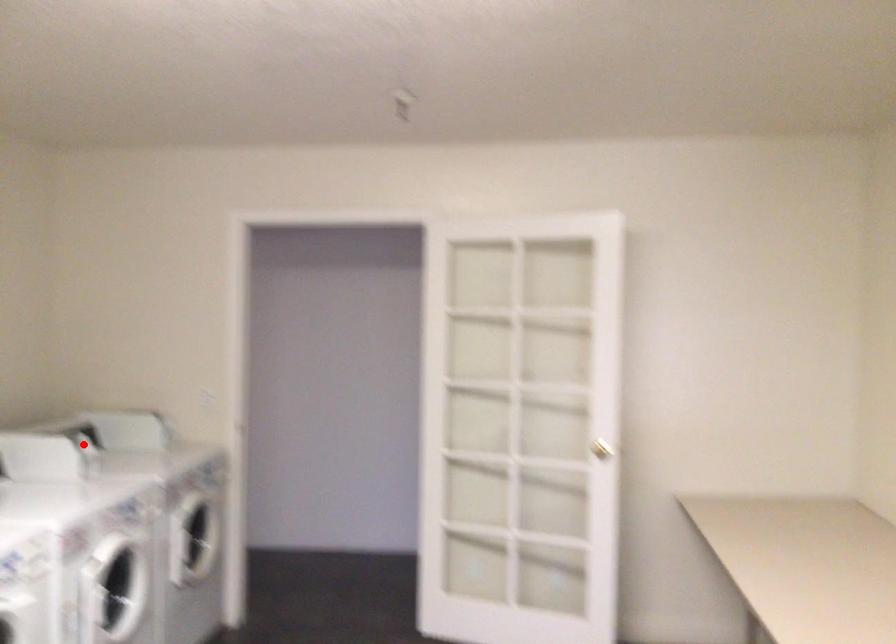
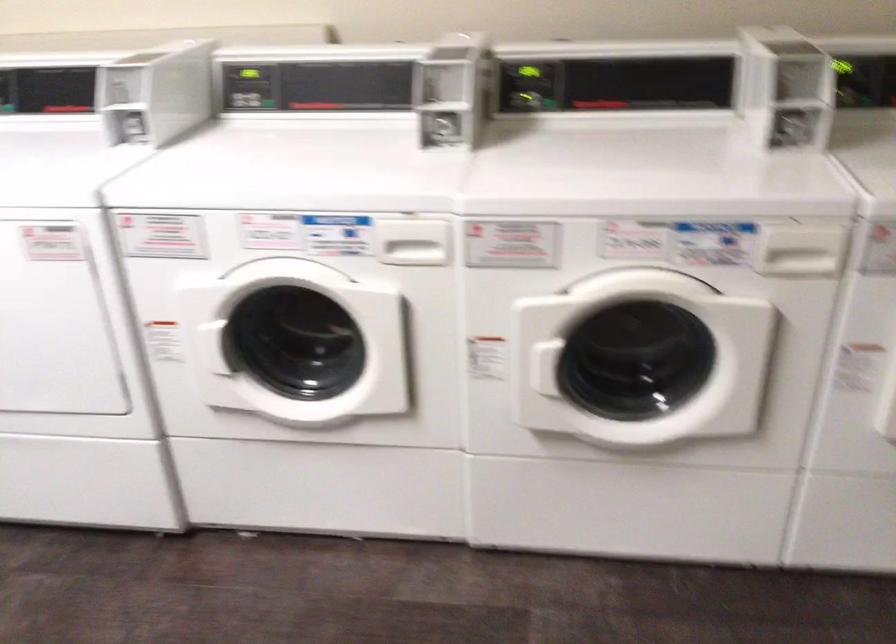
Question: A red point is marked in image1. In image2, is the corresponding 3D point closer to the camera or farther? Reply with the corresponding letter.

Choices:
 (A) The corresponding 3D point is closer.
 (B) The corresponding 3D point is farther.

Answer: (A)